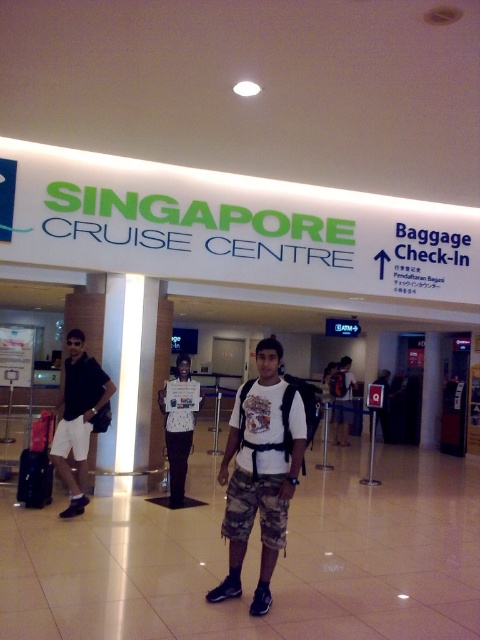
Between white matte shirt at center and white t-shirt at center, which one is positioned higher?

white matte shirt at center is above.

You are a GUI agent. You are given a task and a screenshot of the screen. Output one action in this format:
    pyautogui.click(x=<x>, y=<y>)
    Task: Click on the white matte shirt at center
    
    Given the screenshot: What is the action you would take?
    (177, 448)

Where is `white matte shirt at center`? white matte shirt at center is located at coordinates (177, 448).

Consider the image. Does camo shorts at center lie in front of white matte shirt at center?

Yes, it is in front of white matte shirt at center.

Can you confirm if camo shorts at center is smaller than white matte shirt at center?

Correct, camo shorts at center occupies less space than white matte shirt at center.

Who is more distant from viewer, (261, 481) or (176, 440)?

The point (176, 440) is more distant.

This screenshot has width=480, height=640. In order to click on camo shorts at center in this screenshot , I will do `click(261, 472)`.

Is matte black suitcase at left positioned behind white t-shirt at center?

That is False.

Is point (23, 493) farther from camera compared to point (348, 404)?

No, (23, 493) is in front of (348, 404).

Is point (40, 461) closer to camera compared to point (348, 392)?

Yes, point (40, 461) is closer to viewer.

The image size is (480, 640). Find the location of `matte black suitcase at left`. matte black suitcase at left is located at coordinates (36, 465).